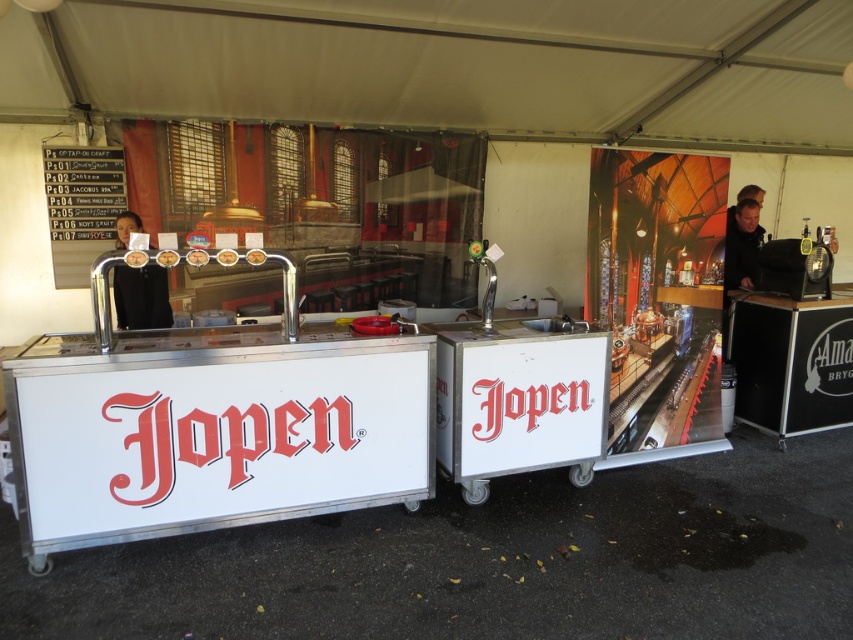
You are a photographer standing at the camera position. You want to take a photo of the black shirt at left without moving the shirt. Can you move yourself closer to the shirt to ensure it fills the frame? Explain why or why not based on the distance provided.

The black shirt at left and camera are 12.34 feet apart from each other. Since you can move yourself closer to the shirt, you can reduce the distance to achieve a better composition. However, the description does not specify any obstacles preventing movement, so moving closer is possible.

You are a photographer at the event and want to capture a photo of the black shirt at left and the dark brown leather jacket at upper right. Which object should you focus on first if you want to ensure both are in focus without adjusting the camera settings?

The black shirt at left has a greater height compared to dark brown leather jacket at upper right, so focusing on the black shirt at left first would ensure both are in focus since it is closer to the camera.